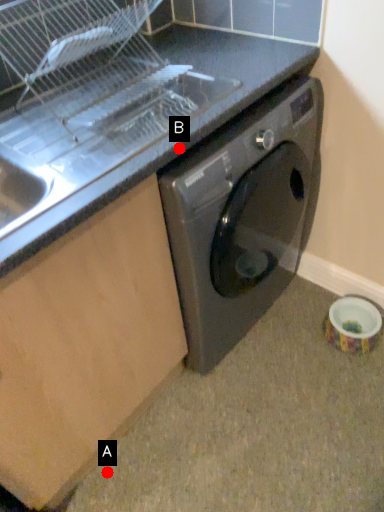
Question: Two points are circled on the image, labeled by A and B beside each circle. Which point is farther from the camera taking this photo?

Choices:
 (A) A is further
 (B) B is further

Answer: (A)